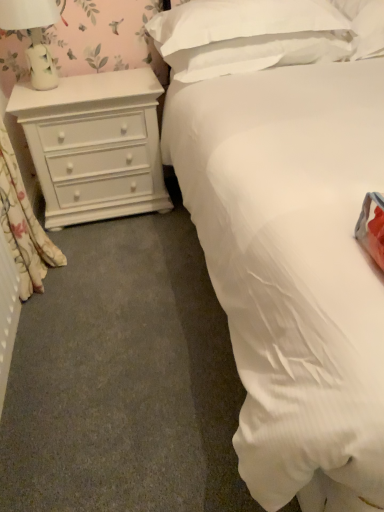
At what (x,y) coordinates should I click in order to perform the action: click on blank area beneath white ceramic lamp at upper left (from a real-world perspective). Please return your answer as a coordinate pair (x, y). Looking at the image, I should click on (63, 85).